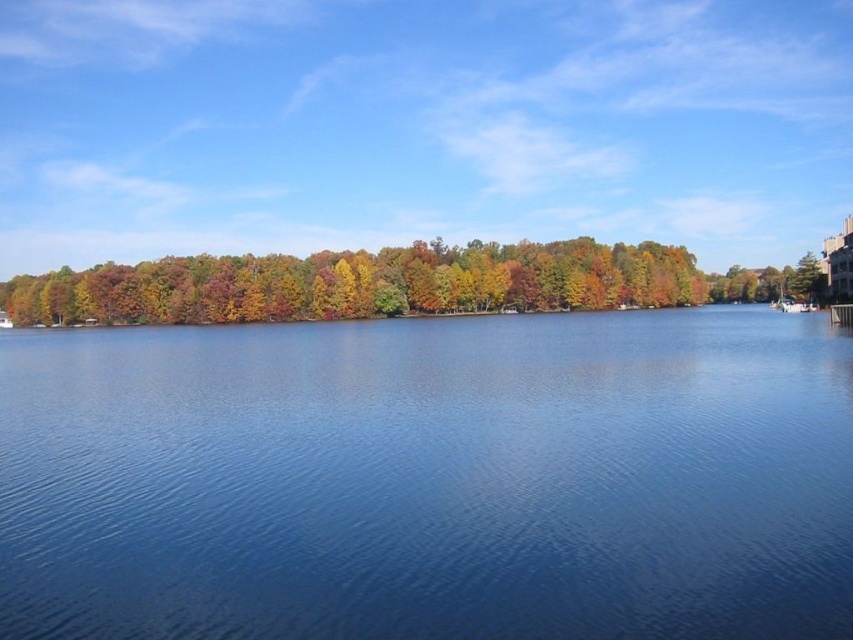
Question: Considering the real-world distances, which object is closest to the autumn leaves at center?

Choices:
 (A) white plastic boat at right
 (B) blue water at center

Answer: (A)

Question: Is blue water at center wider than white plastic boat at right?

Choices:
 (A) yes
 (B) no

Answer: (A)

Question: Which point appears closest to the camera in this image?

Choices:
 (A) (552, 256)
 (B) (798, 369)

Answer: (B)

Question: Estimate the real-world distances between objects in this image. Which object is closer to the blue water at center?

Choices:
 (A) white plastic boat at right
 (B) autumn leaves at center

Answer: (A)

Question: Does autumn leaves at center appear on the right side of white plastic boat at right?

Choices:
 (A) yes
 (B) no

Answer: (B)

Question: Does blue water at center come behind white plastic boat at right?

Choices:
 (A) no
 (B) yes

Answer: (A)